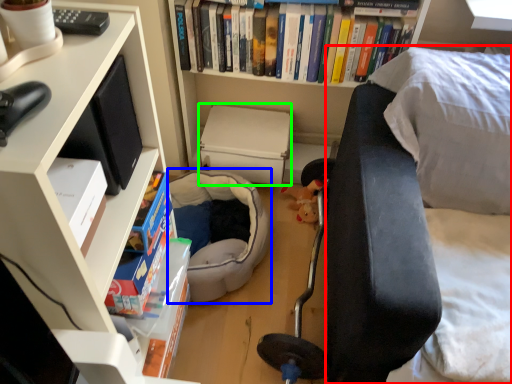
Question: Based on their relative distances, which object is farther from couch (highlighted by a red box)? Choose from bean bag chair (highlighted by a blue box) and paperback book (highlighted by a green box).

Choices:
 (A) bean bag chair
 (B) paperback book

Answer: (B)